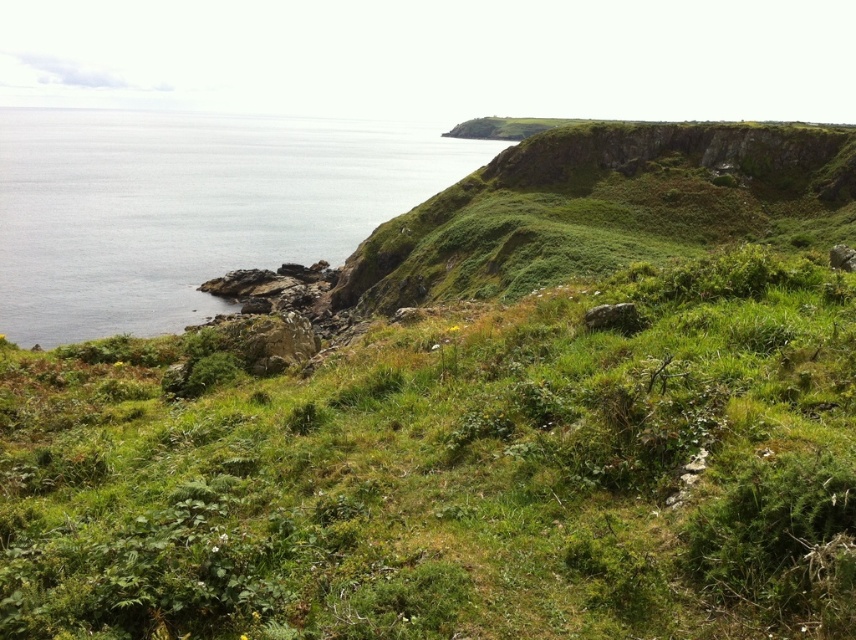
You are standing at the edge of the cliff looking out. Which object, the green grassy at center or the clear blue water at left, is closer to you?

The green grassy at center is closer to the viewer than the clear blue water at left.

You are standing on the green grassy at center and want to reach the clear blue water at left. Which direction should you move to get there?

Since the green grassy at center is below the clear blue water at left, you should move upward to reach the clear blue water at left from the green grassy at center.